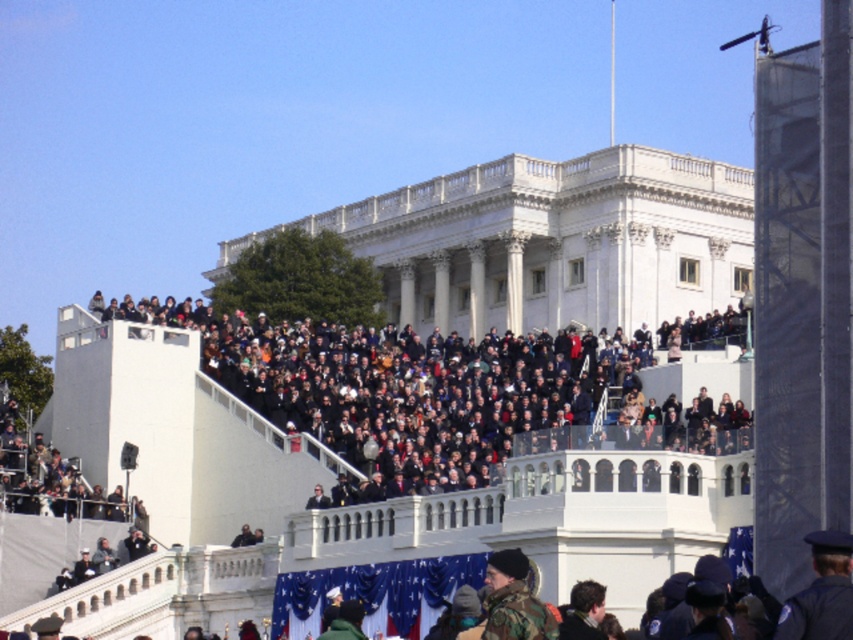
You are a photographer standing at the base of the grand white building. You want to take a photo that includes both the dark gray concrete crowd at upper center and the camouflage jacket at lower center. Which object should you pan your camera to the right to include in the frame first?

The camouflage jacket at lower center should be panned to the right first because the dark gray concrete crowd at upper center is located to the left of it.